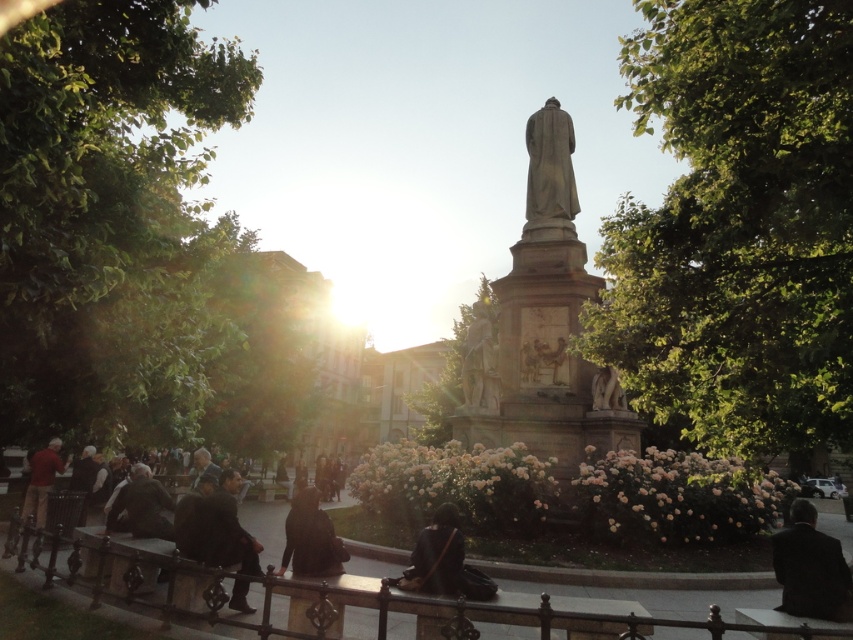
Which of these two, dark brown suit at lower left or dark gray stone statue at center, stands taller?

With more height is dark gray stone statue at center.

Is point (212, 563) behind point (572, 202)?

That is False.

Does point (212, 540) come in front of point (572, 209)?

That is True.

Where is `dark brown suit at lower left`? The height and width of the screenshot is (640, 853). dark brown suit at lower left is located at coordinates (215, 528).

Is point (252, 611) less distant than point (474, 316)?

Yes, point (252, 611) is in front of point (474, 316).

Consider the image. Who is more forward, [254,568] or [489,342]?

Point [254,568] is more forward.

Is point (201, 532) positioned behind point (485, 340)?

No.

I want to click on dark brown suit at lower left, so click(x=215, y=528).

Does point (213, 524) come closer to viewer compared to point (453, 516)?

No, it is not.

This screenshot has width=853, height=640. What do you see at coordinates (215, 528) in the screenshot?
I see `dark brown suit at lower left` at bounding box center [215, 528].

Between point (199, 483) and point (485, 592), which one is positioned behind?

Positioned behind is point (199, 483).

I want to click on dark brown suit at lower left, so click(x=215, y=528).